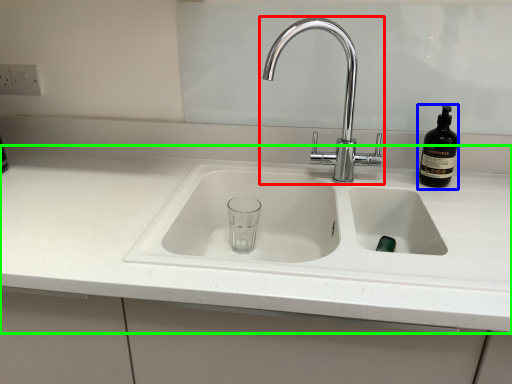
Question: Which object is positioned closest to tap (highlighted by a red box)? Select from bottle (highlighted by a blue box) and countertop (highlighted by a green box).

Choices:
 (A) bottle
 (B) countertop

Answer: (A)